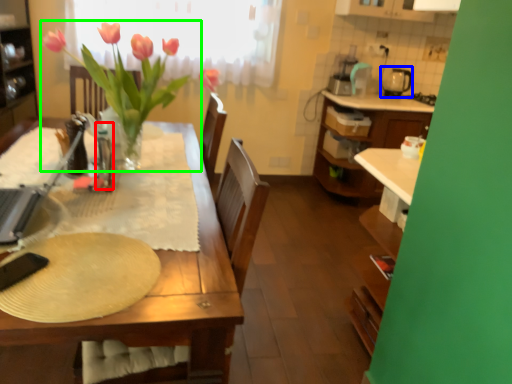
Question: Considering the real-world distances, which object is farthest from bottle (highlighted by a red box)? appliance (highlighted by a blue box) or houseplant (highlighted by a green box)?

Choices:
 (A) appliance
 (B) houseplant

Answer: (A)